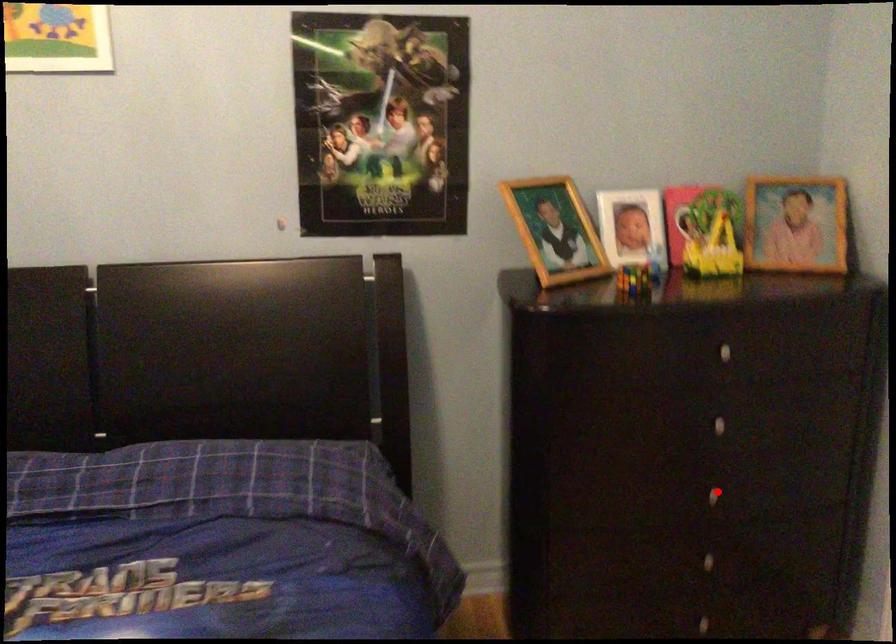
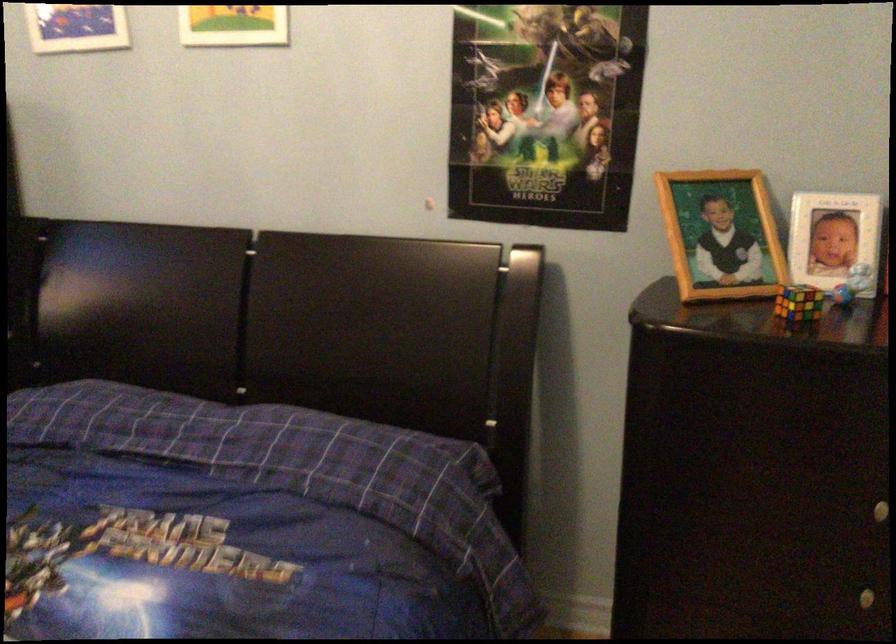
Question: I am providing you with two images of the same scene from different viewpoints. Image1 has a red point marked. In image2, the corresponding 3D location appears at what relative position? Reply with the corresponding letter.

Choices:
 (A) Closer
 (B) Farther

Answer: (A)